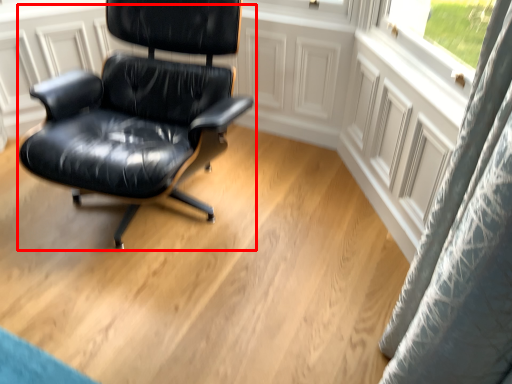
Question: In this image, where is chair (annotated by the red box) located relative to curtain?

Choices:
 (A) right
 (B) left

Answer: (B)